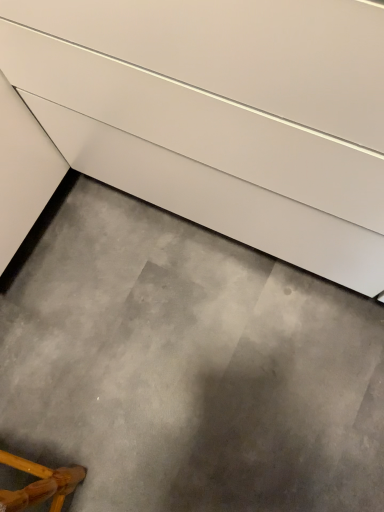
What are the coordinates of `vacant point to the right of wooden chair at lower left` in the screenshot? It's located at (119, 442).